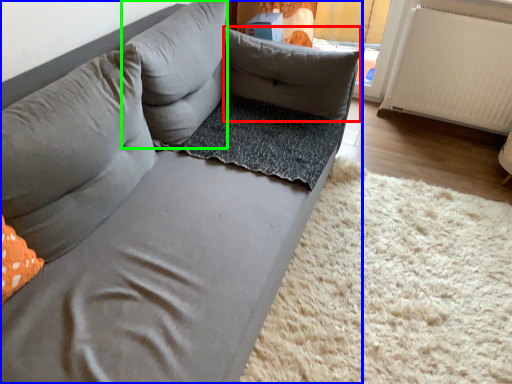
Question: Which is nearer to the pillow (highlighted by a red box)? studio couch (highlighted by a blue box) or pillow (highlighted by a green box).

Choices:
 (A) studio couch
 (B) pillow

Answer: (B)